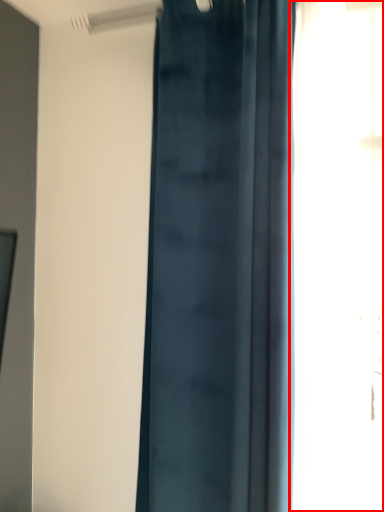
Question: Where is window (annotated by the red box) located in relation to curtain in the image?

Choices:
 (A) left
 (B) right

Answer: (B)